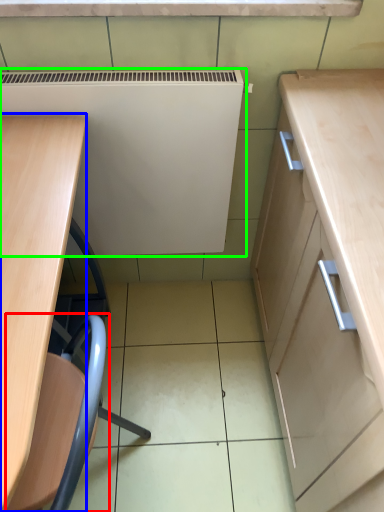
Question: Which object is positioned farthest from swivel chair (highlighted by a red box)? Select from desk (highlighted by a blue box) and appliance (highlighted by a green box).

Choices:
 (A) desk
 (B) appliance

Answer: (B)